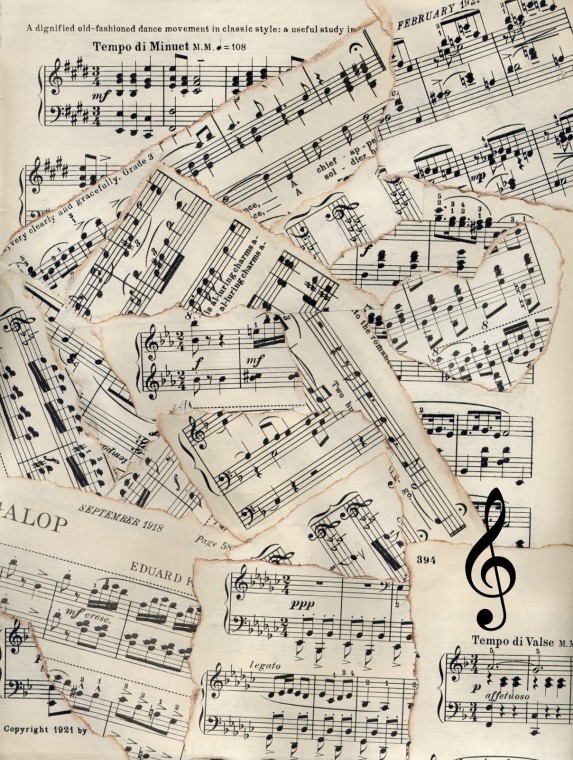
Identify the location of music sheets. Image resolution: width=573 pixels, height=760 pixels. (528, 689), (329, 669), (113, 610), (281, 460), (443, 233), (332, 97), (500, 131), (113, 100), (160, 258).